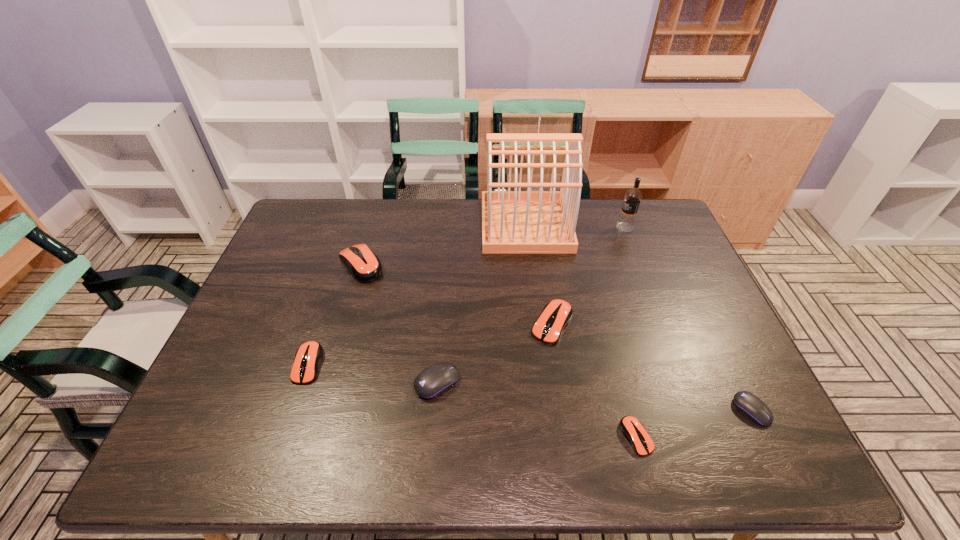
This screenshot has width=960, height=540. I want to click on the tallest object, so click(513, 222).

Where is `beige birdcage`? beige birdcage is located at coordinates tap(513, 222).

Locate an element on the screen. The image size is (960, 540). the seventh object from left to right is located at coordinates (626, 222).

Locate an element on the screen. This screenshot has height=540, width=960. vodka is located at coordinates (626, 222).

The height and width of the screenshot is (540, 960). Identify the location of the tallest computer mouse. (364, 265).

This screenshot has height=540, width=960. What are the coordinates of `the farthest computer mouse` in the screenshot? It's located at coord(364,265).

Identify the location of the second orange computer mouse from right to left. This screenshot has width=960, height=540. (556, 315).

You are a GUI agent. You are given a task and a screenshot of the screen. Output one action in this format:
    pyautogui.click(x=<x>, y=<y>)
    Task: Click on the third smallest orange computer mouse
    Image resolution: width=960 pixels, height=540 pixels.
    Given the screenshot: What is the action you would take?
    pyautogui.click(x=556, y=315)

What are the coordinates of `the sixth object from right to left` in the screenshot? It's located at 433,381.

Identify the location of the left black computer mouse. This screenshot has width=960, height=540. (433, 381).